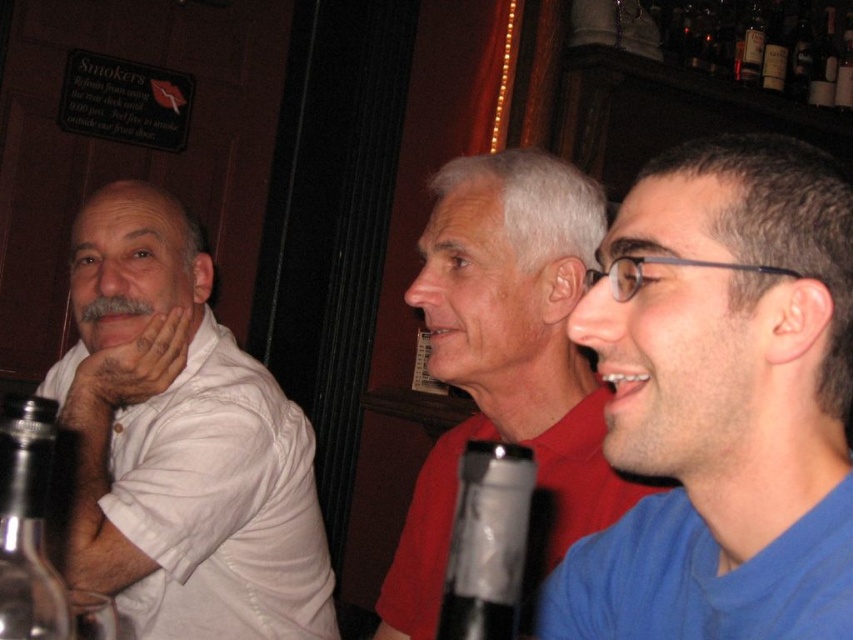
Looking at this image, you are a bartender observing the scene. You need to deliver a drink to the blue fabric shirt at right and the clear glass bottle at left. Which of the two should you serve first if you want to follow the standard bar serving order from left to right?

The standard bar serving order is typically from left to right. Since the clear glass bottle at left is on the left side and the blue fabric shirt at right is on the right, you should serve the clear glass bottle at left first.

You are a photographer trying to capture a candid shot of the blue fabric shirt at right and the clear glass bottle at left. Based on their positions, which object should you focus on first if you want to include both in the same frame without moving your camera?

The blue fabric shirt at right is to the right of the clear glass bottle at left. To include both in the same frame without moving the camera, focus on the clear glass bottle at left first since it is positioned to the left of the blue fabric shirt at right, ensuring both are within the shot.

You are standing in front of the scene and want to locate the blue fabric shirt at right. Where would you look relative to the center of the image?

The blue fabric shirt at right is located at the 2D coordinates point (x=722, y=403) relative to the center of the image.